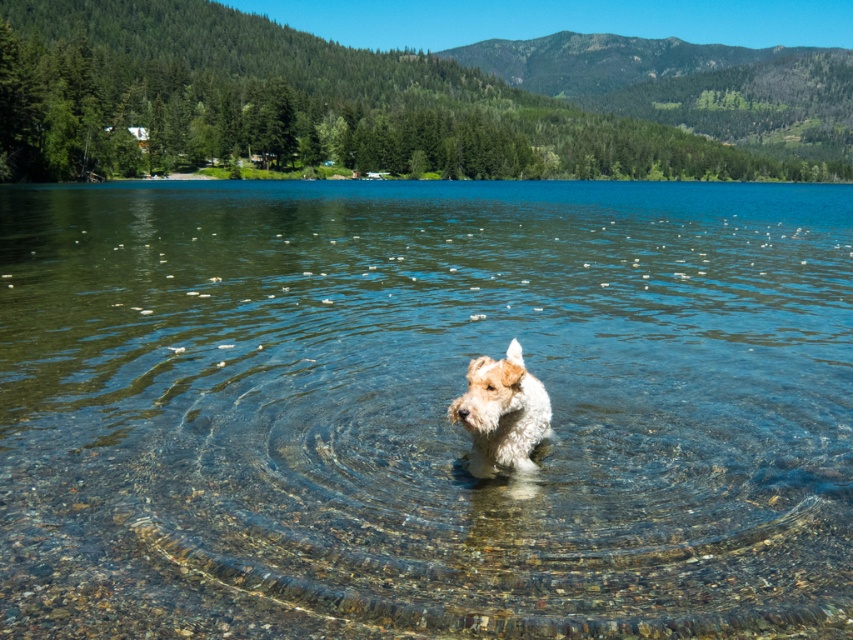
You are a photographer trying to capture the white fur dog at center in the clear glass water at center. Since the water is bigger than the dog, where should you position the dog to ensure it is fully visible in the water?

The clear glass water at center is bigger than the white fur dog at center, so positioning the dog towards the center of the water area ensures it is fully visible within the larger water space.

You are standing on the lakeside and want to take a photo of the white fur dog at center without the clear glass water at center appearing in the frame. Which direction should you move to achieve this?

The clear glass water at center is to the right of the white fur dog at center. To avoid the clear glass water at center in the frame, move to the left side of the white fur dog at center.

You are standing at the edge of the lake and see two points in the water. One is at coordinates point (450,540) and the other is at point (502,448). Which point is closer to you?

Point (450,540) is closer to the viewer than point (502,448).